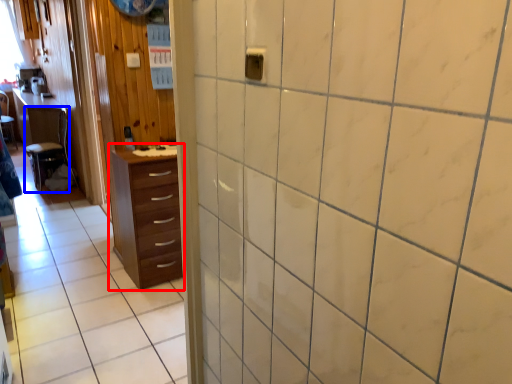
Question: Among these objects, which one is nearest to the camera, chest of drawers (highlighted by a red box) or furniture (highlighted by a blue box)?

Choices:
 (A) chest of drawers
 (B) furniture

Answer: (A)